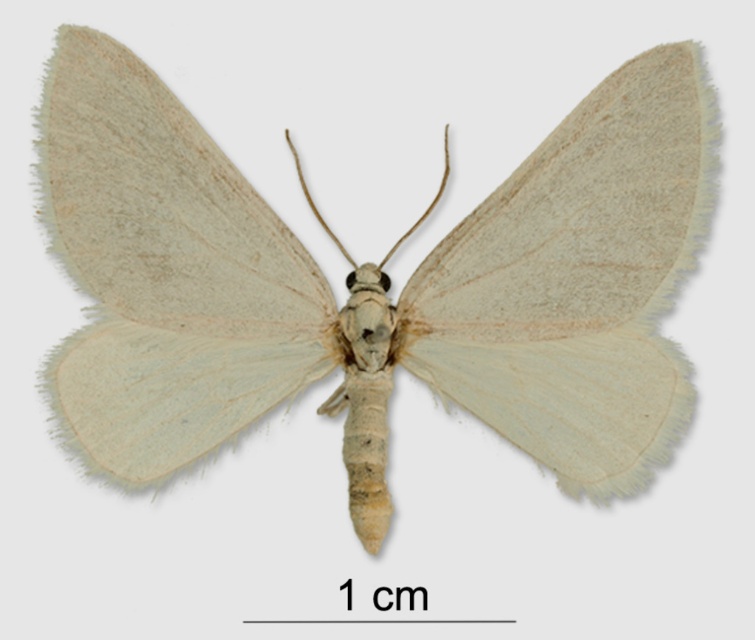
Which is below, light green fuzzy moth at center or light green fringed moth wing at center?

Positioned lower is light green fuzzy moth at center.

Between light green fuzzy moth at center and light green fringed moth wing at center, which one has less height?

Standing shorter between the two is light green fringed moth wing at center.

Between point (519, 445) and point (66, 224), which one is positioned in front?

Positioned in front is point (66, 224).

The width and height of the screenshot is (755, 640). Find the location of `light green fuzzy moth at center`. light green fuzzy moth at center is located at coordinates (578, 282).